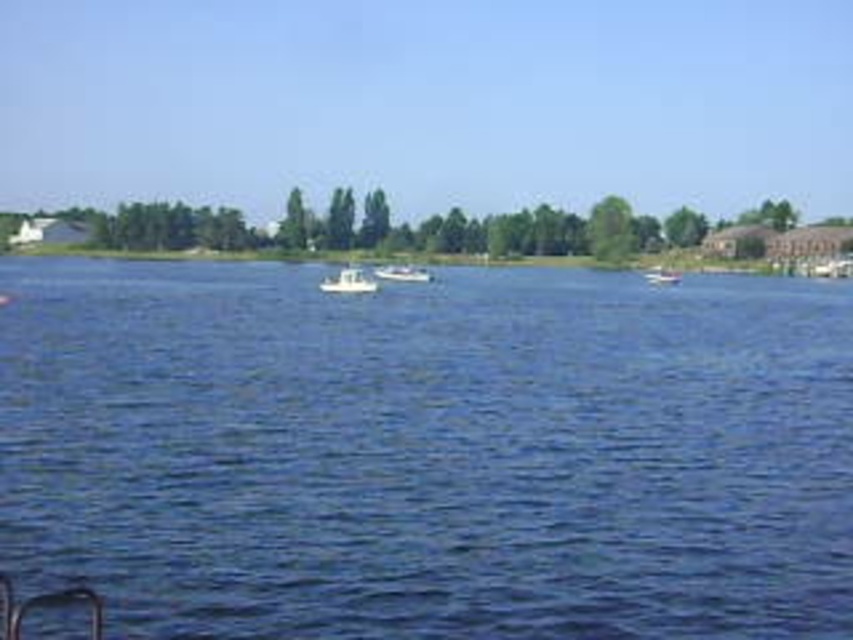
Can you confirm if white plastic boat at center is smaller than white matte boat at center?

No.

Is white plastic boat at center behind white matte boat at center?

That is False.

Is point (347, 289) behind point (405, 269)?

No, it is not.

Identify the location of white plastic boat at center. (349, 282).

Is blue liquid water at center smaller than white plastic boat at center?

Actually, blue liquid water at center might be larger than white plastic boat at center.

Is point (751, 436) farther from camera compared to point (329, 288)?

No, it is in front of (329, 288).

The height and width of the screenshot is (640, 853). Identify the location of blue liquid water at center. (428, 451).

The height and width of the screenshot is (640, 853). In order to click on white matte boat at center in this screenshot , I will do `click(403, 273)`.

Between point (387, 280) and point (654, 266), which one is positioned in front?

Positioned in front is point (387, 280).

The image size is (853, 640). Identify the location of white matte boat at center. (403, 273).